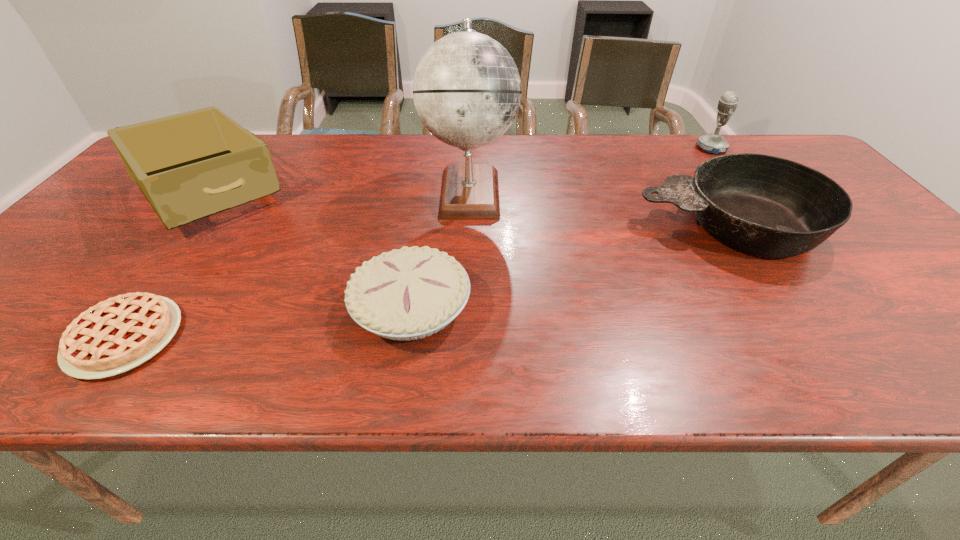
At what (x,y) coordinates should I click in order to perform the action: click on the tallest object. Please return your answer as a coordinate pair (x, y). The height and width of the screenshot is (540, 960). Looking at the image, I should click on (467, 91).

You are a GUI agent. You are given a task and a screenshot of the screen. Output one action in this format:
    pyautogui.click(x=<x>, y=<y>)
    Task: Click on the microphone
    
    Given the screenshot: What is the action you would take?
    pyautogui.click(x=712, y=143)

This screenshot has width=960, height=540. Identify the location of box. [189, 166].

Locate an element on the screen. The height and width of the screenshot is (540, 960). the third shortest object is located at coordinates (766, 206).

Where is `the fifth tallest object`? the fifth tallest object is located at coordinates (410, 293).

What are the coordinates of `the right pie` in the screenshot? It's located at (410, 293).

This screenshot has height=540, width=960. What are the coordinates of `the left pie` in the screenshot? It's located at (114, 336).

Identify the location of the shortest object. (114, 336).

Where is `vacant space located 0.340m at the equator of the tallest object`? vacant space located 0.340m at the equator of the tallest object is located at coordinates (638, 192).

The height and width of the screenshot is (540, 960). What are the coordinates of `vacant space located on the front-facing side of the microphone` in the screenshot? It's located at (588, 148).